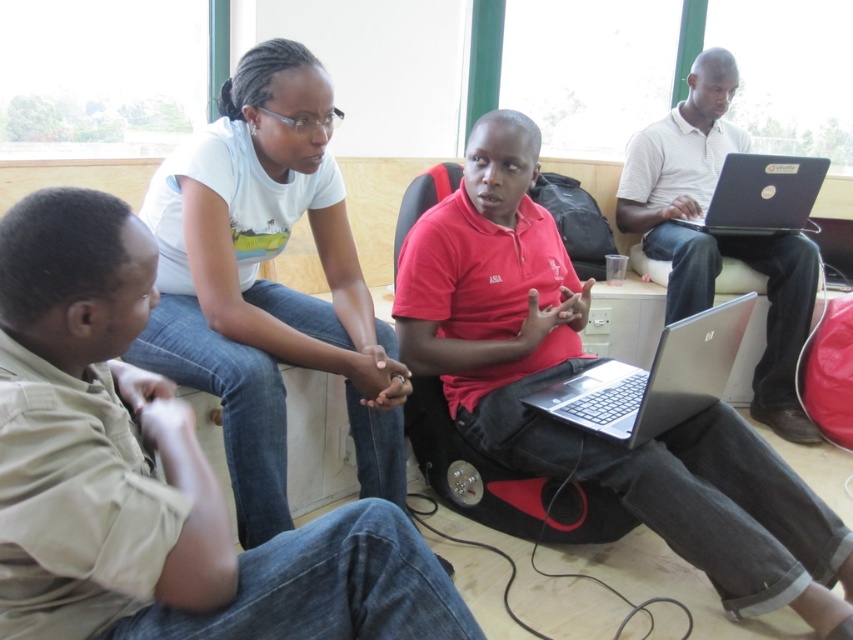
Based on the scene description, which object is positioned lower in the image? The khaki cotton shirt at lower left or the white cotton shirt at upper center?

The khaki cotton shirt at lower left is positioned below the white cotton shirt at upper center, so it is lower in the image.

Based on the scene description, which object is smaller in size between the khaki cotton shirt at lower left and the white cotton shirt at upper center?

The khaki cotton shirt at lower left is smaller in size compared to the white cotton shirt at upper center according to the description.

You are a photographer positioned at the entrance of the room. You notice the white striped polo shirt at upper right and the silver metallic laptop at center. Which object would appear larger in your camera viewfinder?

The white striped polo shirt at upper right appears larger in the camera viewfinder because it is taller than the silver metallic laptop at center.